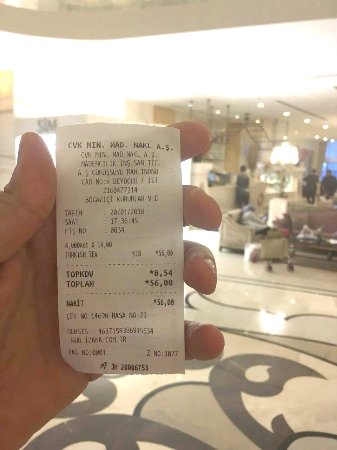
This screenshot has height=450, width=337. What are the coordinates of `chandelier` in the screenshot? It's located at (281, 155).